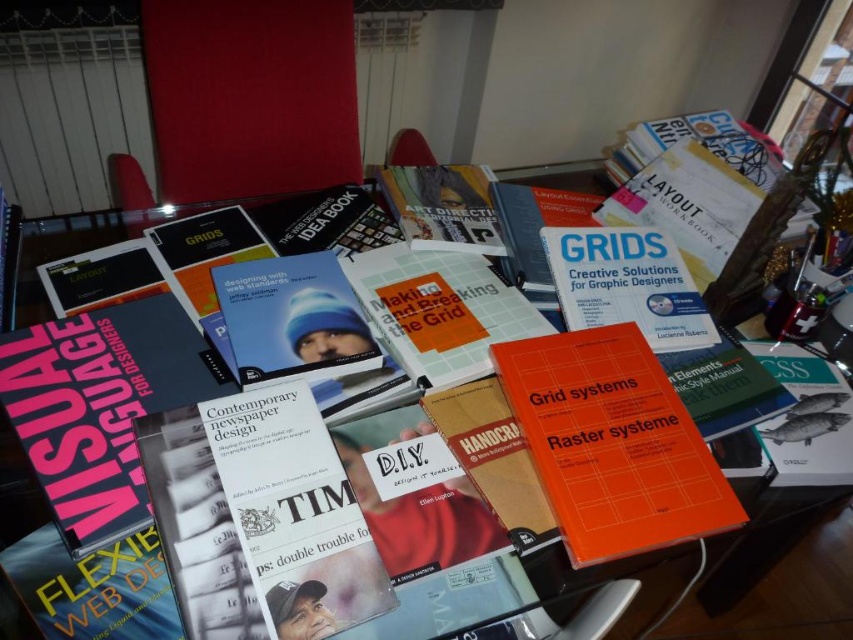
What are the coordinates of the orange matte book at center?

The orange matte book at center is located at coordinates point (612, 444).

Based on the photo, you are organizing a bookshelf and need to know the height of the orange matte book at center and the transparent glass table at center. Which one is shorter?

The orange matte book at center is shorter than the transparent glass table at center.